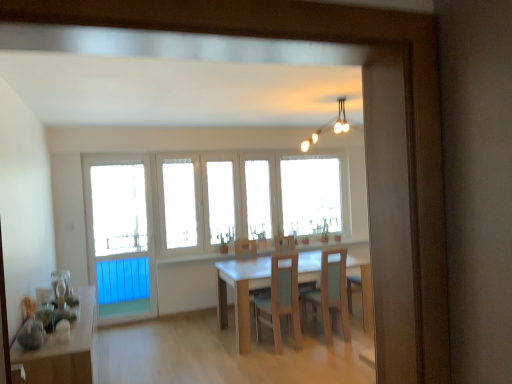
Question: Considering the relative sizes of light wood chair at center, the 1th chair in the right-to-left sequence, and white glass windows at center in the image provided, is light wood chair at center, the 1th chair in the right-to-left sequence, shorter than white glass windows at center?

Choices:
 (A) yes
 (B) no

Answer: (A)

Question: Does light wood chair at center, positioned as the 2th chair in left-to-right order, contain white glass windows at center?

Choices:
 (A) yes
 (B) no

Answer: (B)

Question: Is light wood chair at center, the 1th chair in the right-to-left sequence, completely or partially outside of white glass windows at center?

Choices:
 (A) no
 (B) yes

Answer: (B)

Question: From a real-world perspective, is light wood chair at center, positioned as the 2th chair in left-to-right order, physically below white glass windows at center?

Choices:
 (A) yes
 (B) no

Answer: (A)

Question: Is light wood chair at center, the 1th chair in the right-to-left sequence, taller than white glass windows at center?

Choices:
 (A) yes
 (B) no

Answer: (B)

Question: Based on their sizes in the image, would you say wooden table at lower left, which ranks as the 1th table in left-to-right order, is bigger or smaller than light wood/matte chair at center, which is counted as the 2th chair, starting from the right?

Choices:
 (A) big
 (B) small

Answer: (A)

Question: Considering the positions of wooden table at lower left, acting as the second table starting from the right, and light wood/matte chair at center, which is counted as the 2th chair, starting from the right, in the image, is wooden table at lower left, acting as the second table starting from the right, taller or shorter than light wood/matte chair at center, which is counted as the 2th chair, starting from the right,?

Choices:
 (A) tall
 (B) short

Answer: (B)

Question: From the image's perspective, is wooden table at lower left, acting as the second table starting from the right, located above or below light wood/matte chair at center, the first chair in the left-to-right sequence?

Choices:
 (A) above
 (B) below

Answer: (B)

Question: Choose the correct answer: Is wooden table at lower left, acting as the second table starting from the right, inside light wood/matte chair at center, the first chair in the left-to-right sequence, or outside it?

Choices:
 (A) outside
 (B) inside

Answer: (A)

Question: Relative to light wood/matte chair at center, the first chair in the left-to-right sequence, is wooden table at center, the 1th table when ordered from right to left, in front or behind?

Choices:
 (A) behind
 (B) front

Answer: (A)

Question: In terms of width, does wooden table at center, positioned as the second table in left-to-right order, look wider or thinner when compared to light wood/matte chair at center, which is counted as the 2th chair, starting from the right?

Choices:
 (A) thin
 (B) wide

Answer: (B)

Question: Is point (355, 258) positioned closer to the camera than point (259, 312)?

Choices:
 (A) farther
 (B) closer

Answer: (B)

Question: Is wooden table at center, the 1th table when ordered from right to left, spatially inside light wood/matte chair at center, which is counted as the 2th chair, starting from the right, or outside of it?

Choices:
 (A) outside
 (B) inside

Answer: (A)

Question: From a real-world perspective, is light wood chair at center, positioned as the 2th chair in left-to-right order, physically located above or below wooden table at lower left, which ranks as the 1th table in left-to-right order?

Choices:
 (A) above
 (B) below

Answer: (A)

Question: Choose the correct answer: Is light wood chair at center, positioned as the 2th chair in left-to-right order, inside wooden table at lower left, acting as the second table starting from the right, or outside it?

Choices:
 (A) outside
 (B) inside

Answer: (A)